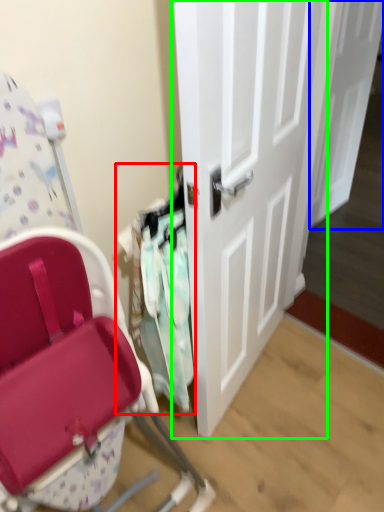
Question: Which object is positioned closest to laundry (highlighted by a red box)? Select from door (highlighted by a blue box) and door (highlighted by a green box).

Choices:
 (A) door
 (B) door

Answer: (B)